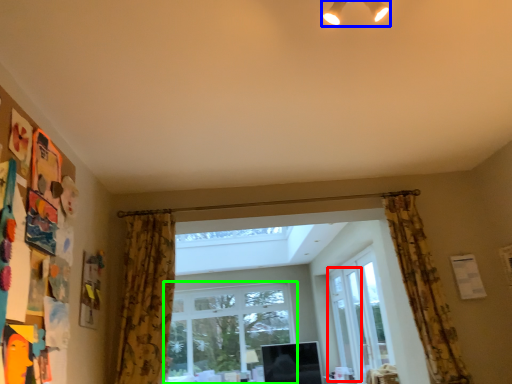
Question: Which object is the closest to the screen door (highlighted by a red box)? Choose among these: light fixture (highlighted by a blue box) or window (highlighted by a green box).

Choices:
 (A) light fixture
 (B) window

Answer: (B)